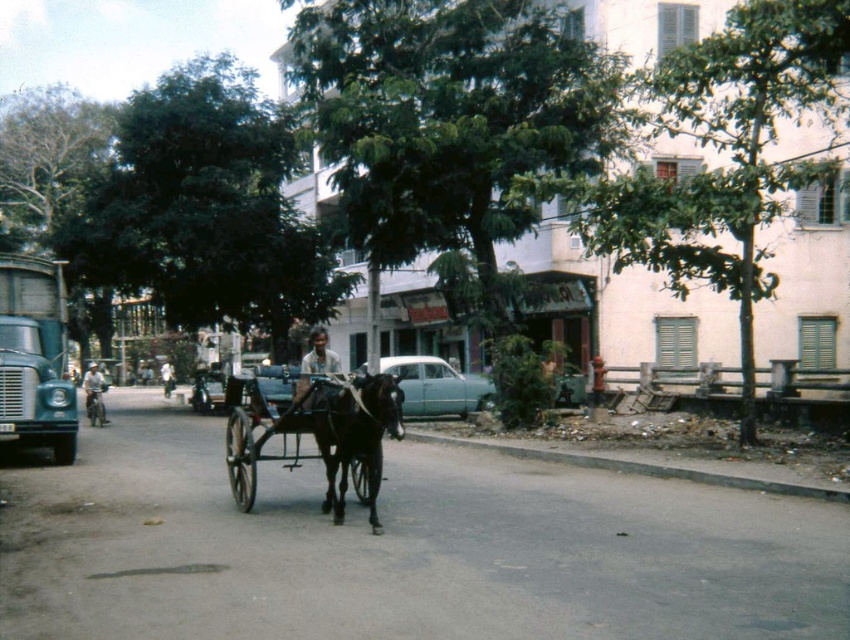
Question: Which is farther from the white matte shirt at center?

Choices:
 (A) light blue metallic car at center
 (B) shiny black cart at center
 (C) light brown skin at center
 (D) black glossy horse at center

Answer: (B)

Question: Does light blue shirt at left have a lesser width compared to white matte shirt at center?

Choices:
 (A) no
 (B) yes

Answer: (A)

Question: Which of the following is the closest to the observer?

Choices:
 (A) light blue shirt at left
 (B) light brown skin at center
 (C) light blue metallic car at center
 (D) white matte shirt at center

Answer: (C)

Question: Observing the image, what is the correct spatial positioning of black glossy horse at center in reference to light blue metallic car at center?

Choices:
 (A) left
 (B) right

Answer: (A)

Question: Does light blue metallic car at center appear over white matte shirt at center?

Choices:
 (A) no
 (B) yes

Answer: (B)

Question: Among these objects, which one is nearest to the camera?

Choices:
 (A) black glossy horse at center
 (B) light blue shirt at left
 (C) light brown skin at center
 (D) shiny black cart at center

Answer: (A)